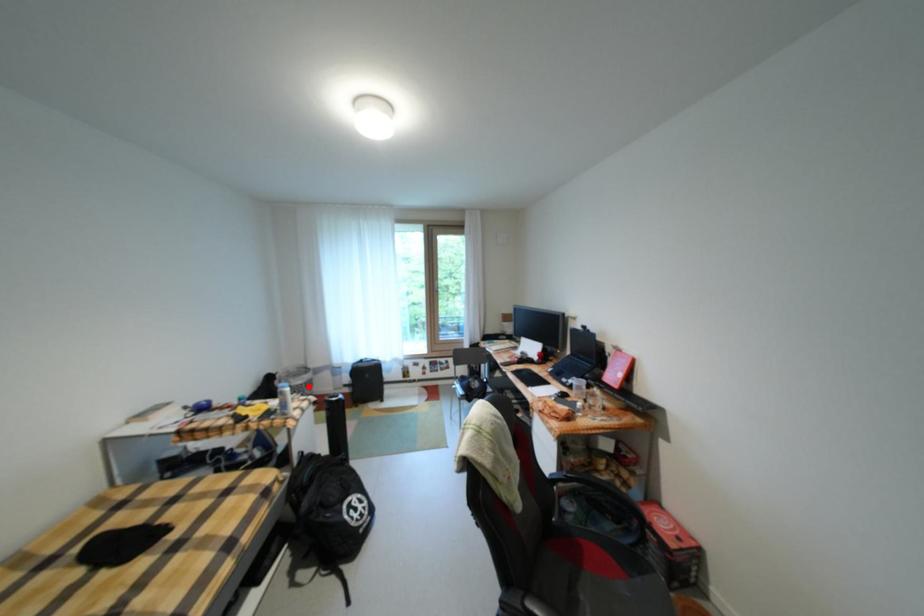
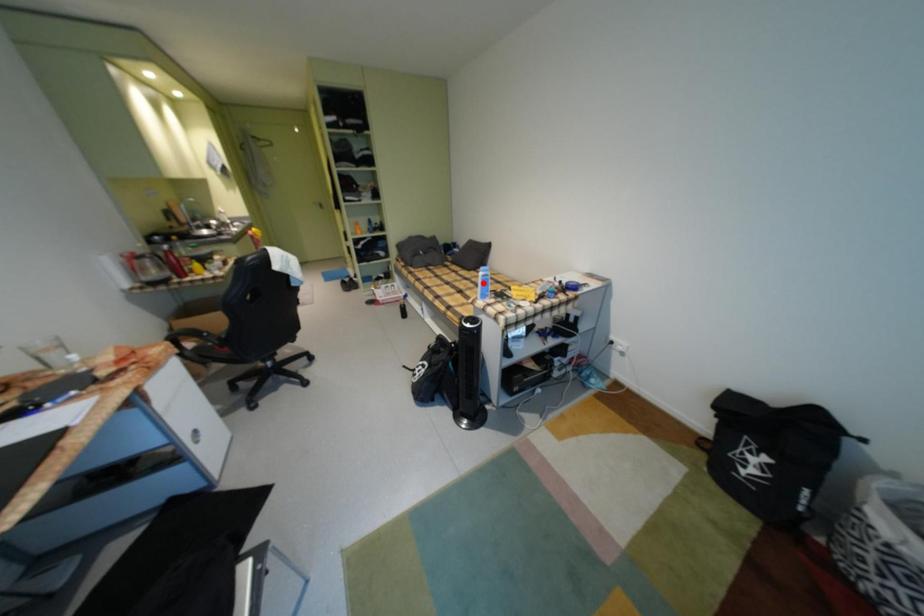
I am providing you with two images of the same scene from different viewpoints. A red point is marked on the first image and another point is marked on the second image. Is the marked point in image1 the same physical position as the marked point in image2?

No